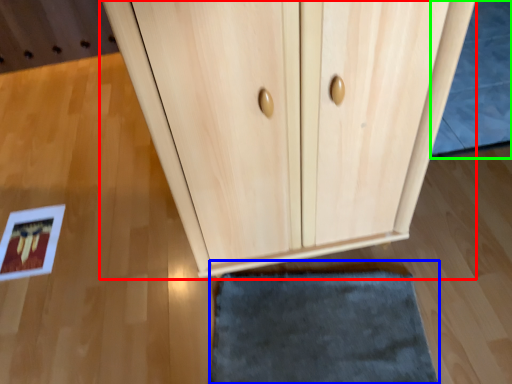
Question: Based on their relative distances, which object is farther from cupboard (highlighted by a red box)? Choose from door (highlighted by a blue box) and bath mat (highlighted by a green box).

Choices:
 (A) door
 (B) bath mat

Answer: (B)